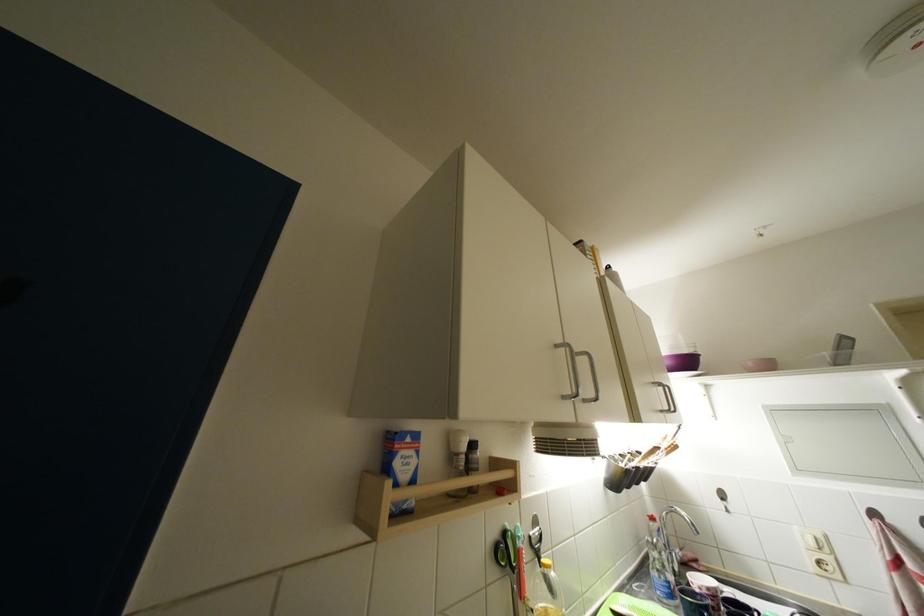
Find the location of a particular element. pair of scissors is located at coordinates (513, 565).